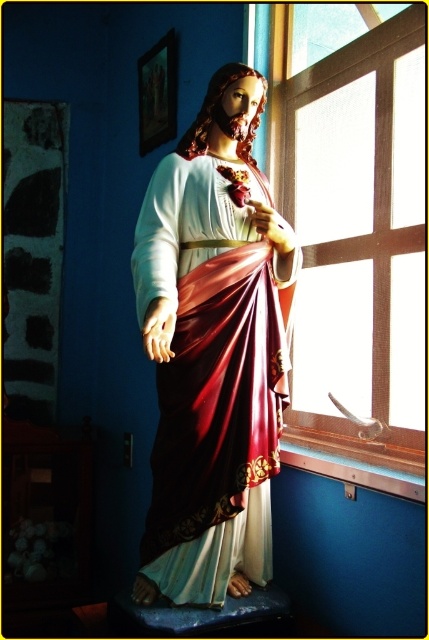
You are an interior designer planning to place a new decorative item in the room where the matte gold statue at center is located. The room has a window on the right side. To ensure the new item won not block the view of the statue from the entrance, where should you place it relative to the window?

The matte gold statue at center is located at point (214, 349), so placing the new item to the right side of the window would keep it from blocking the statue as the window is on the right side of the image.

You are standing in a church and want to take a photo of the matte gold statue at center and the clear glass window at center. Which object will appear larger in your photo?

The matte gold statue at center will appear larger in the photo because it is closer to the viewer than the clear glass window at center.

You are standing in a church and want to place a bouquet of flowers at the base of the matte gold statue at center. If your arm reaches 3 feet, can you place the bouquet without moving closer?

The matte gold statue at center is 3.39 feet away from the viewer. Since your arm reaches 3 feet, you cannot quite reach the base of the matte gold statue at center and would need to move closer.